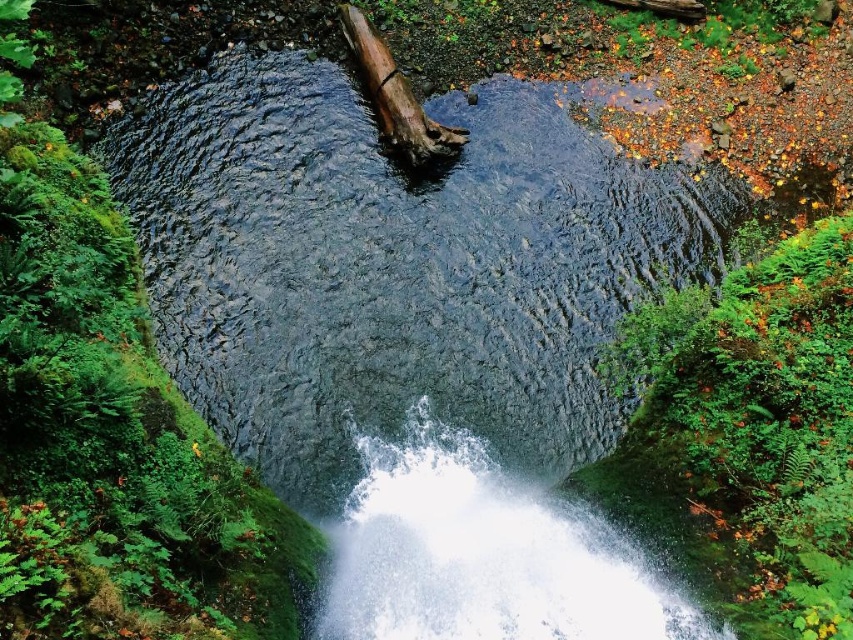
Does white frothy water at center have a lesser height compared to brown rough log at center?

No, white frothy water at center is not shorter than brown rough log at center.

Based on the photo, is white frothy water at center wider than brown rough log at center?

Yes.

Image resolution: width=853 pixels, height=640 pixels. Find the location of `white frothy water at center`. white frothy water at center is located at coordinates pos(485,552).